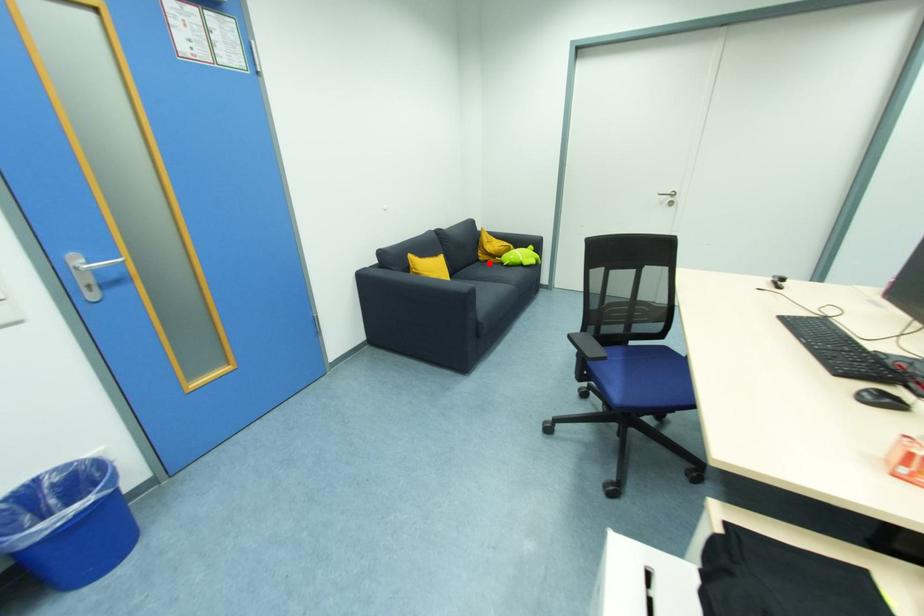
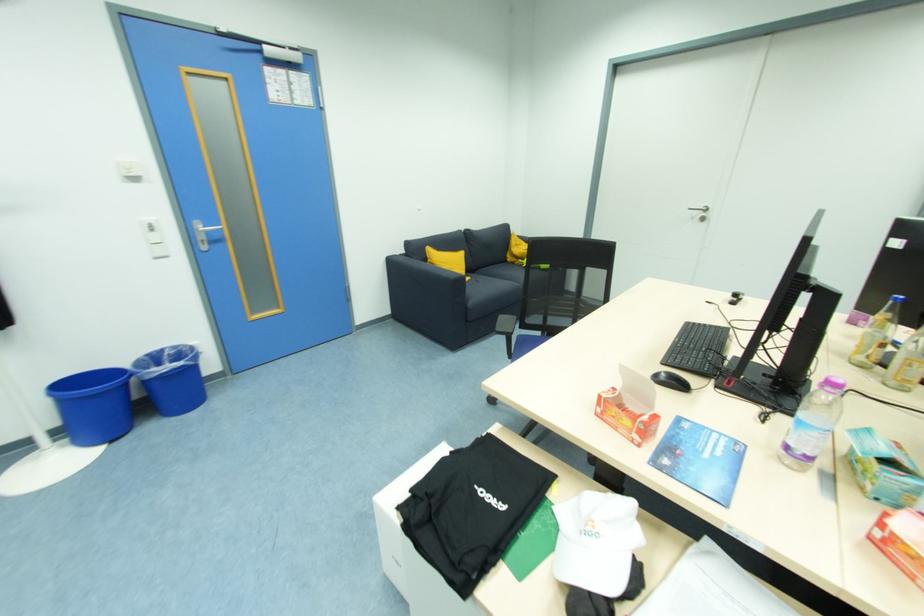
Locate, in the second image, the point that corresponds to the highlighted location in the first image.

(516, 265)